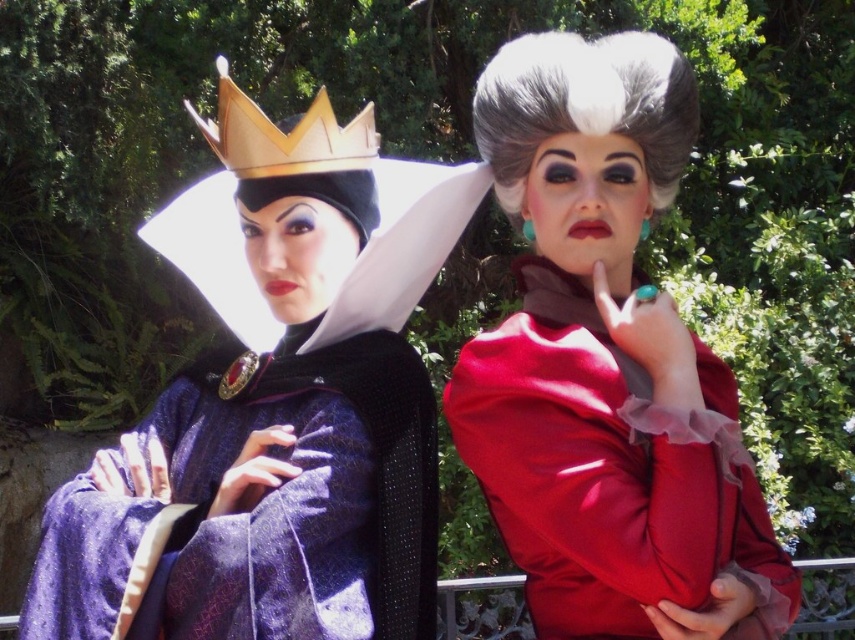
From the picture: You are a photographer adjusting your camera to focus on both the white fluffy wig at upper center and the gold metallic crown at upper left. Which object should you focus on first to ensure both are in sharp focus?

You should focus on the white fluffy wig at upper center first because it is closer to the viewer than the gold metallic crown at upper left, ensuring both will be in focus when starting from the closer object.

You are a photographer setting up for a photoshoot and need to ensure proper lighting. The velvet purple gown at center and the gold metallic crown at upper left are both important subjects. Based on their positions, which object is closer to the camera?

The gold metallic crown at upper left is positioned above the velvet purple gown at center, so it is closer to the camera.

You are standing in front of the two costumed individuals. Which of the two points, point 1 at coordinates [555,436] or point 2 at [240,102], is closer to you?

Point 1 at coordinates [555,436] is closer to you because it is in front of point 2 at [240,102].